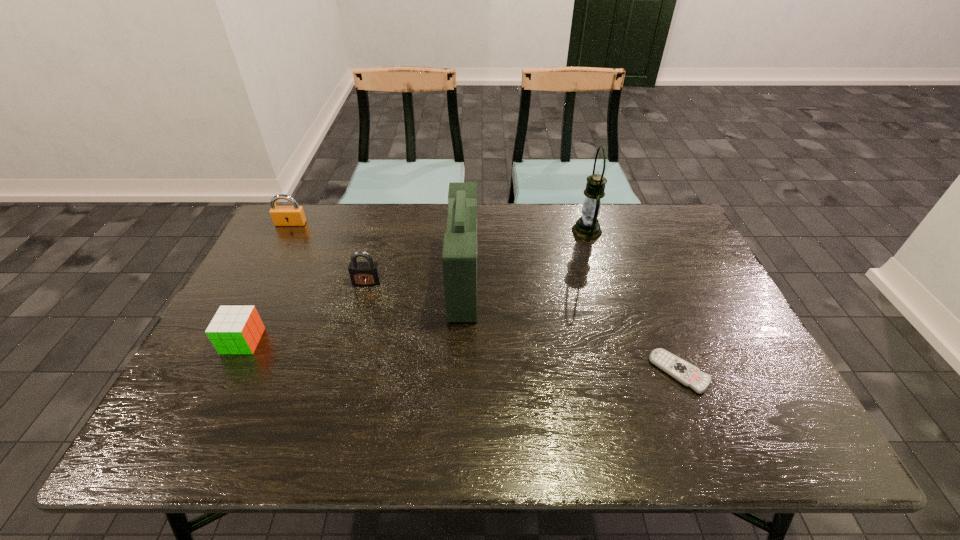
Identify the location of padlock located in the left edge section of the desktop. The image size is (960, 540). (294, 215).

I want to click on cube that is positioned at the left edge, so pyautogui.click(x=234, y=329).

Image resolution: width=960 pixels, height=540 pixels. Find the location of `object that is at the right edge`. object that is at the right edge is located at coordinates (687, 374).

At what (x,y) coordinates should I click in order to perform the action: click on object at the far left corner. Please return your answer as a coordinate pair (x, y). The image size is (960, 540). Looking at the image, I should click on (294, 215).

The width and height of the screenshot is (960, 540). Identify the location of vacant space at the far edge. (520, 234).

The height and width of the screenshot is (540, 960). What are the coordinates of `vacant space at the near edge` in the screenshot? It's located at tap(394, 447).

In the image, there is a desktop. Where is `vacant space at the left edge`? The width and height of the screenshot is (960, 540). vacant space at the left edge is located at coordinates (276, 260).

The height and width of the screenshot is (540, 960). In order to click on free location at the right edge in this screenshot , I will do `click(710, 273)`.

Where is `vacant region at the far left corner of the desktop`? This screenshot has width=960, height=540. vacant region at the far left corner of the desktop is located at coordinates (296, 239).

Identify the location of vacant area that lies between the left padlock and the second shortest object. (267, 282).